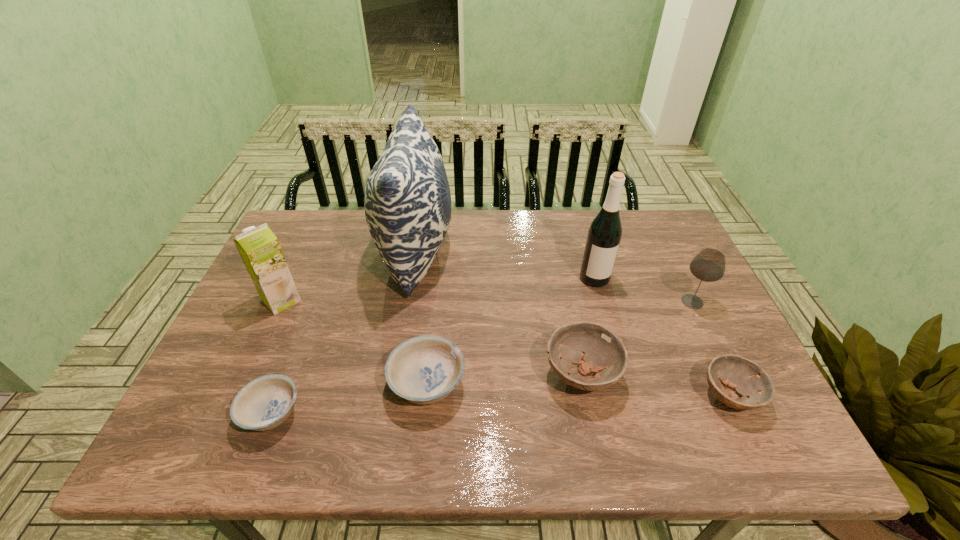
What are the coordinates of `free space between the left blue bowl and the wineglass` in the screenshot? It's located at (482, 357).

Identify which object is the second closest to the shortest bowl. Please provide its 2D coordinates. Your answer should be formatted as a tuple, i.e. [(x, y)], where the tuple contains the x and y coordinates of a point satisfying the conditions above.

[(259, 248)]

Where is `the fourth closest object to the fourth tallest object`? The width and height of the screenshot is (960, 540). the fourth closest object to the fourth tallest object is located at coordinates (424, 370).

The image size is (960, 540). Identify the location of the closest bowl relative to the dark wine bottle. (596, 349).

Find the location of `bowl that is the third closest to the rightmost bowl`. bowl that is the third closest to the rightmost bowl is located at coordinates (264, 403).

Find the location of a particular element. vacant position in the image that satisfies the following two spatial constraints: 1. on the label of the rightmost bowl; 2. on the right side of the wine bottle is located at coordinates (627, 395).

The image size is (960, 540). In order to click on free location that satisfies the following two spatial constraints: 1. on the front surface of the blue cushion; 2. on the right side of the right brown bowl in this screenshot , I will do `click(393, 395)`.